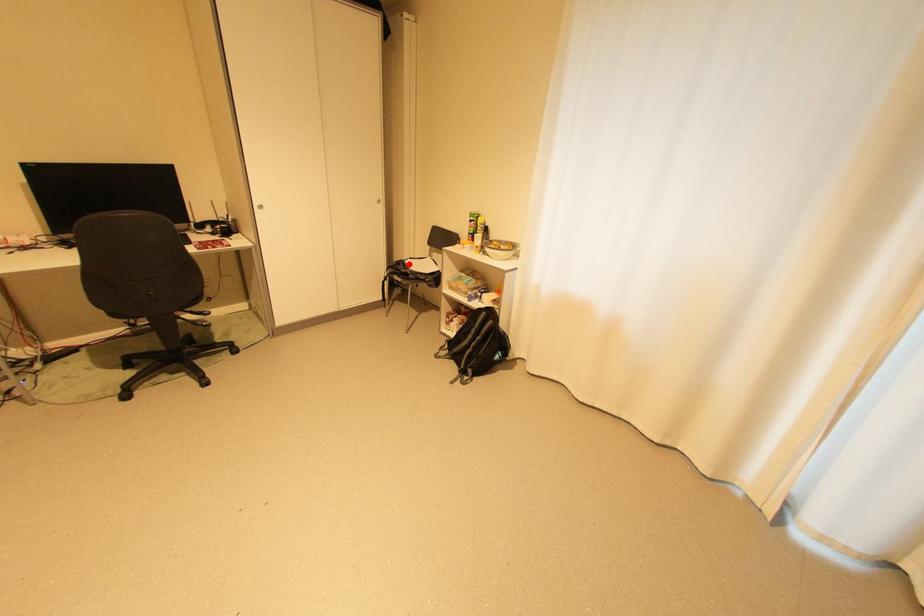
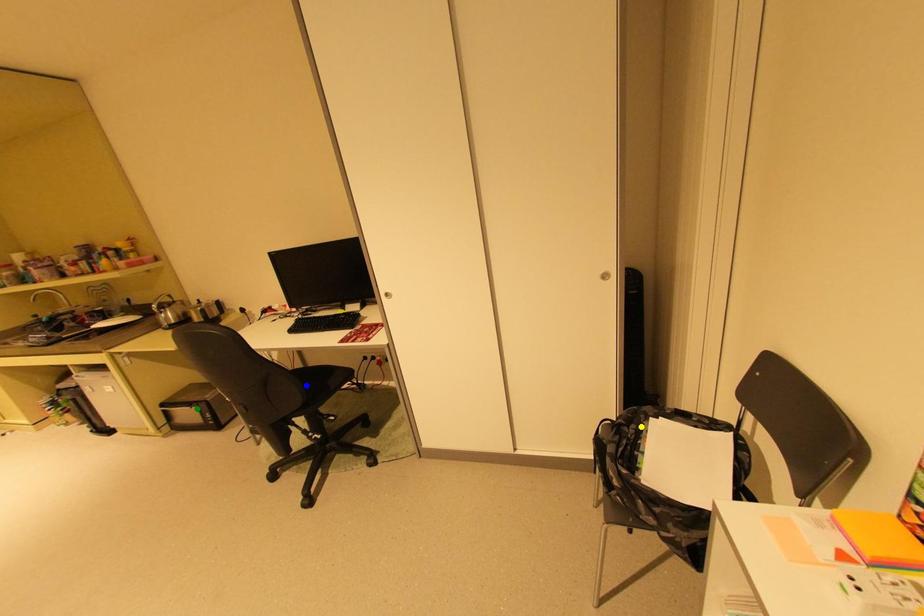
Question: I am providing you with two images of the same scene from different viewpoints. A red point is marked on the first image. You are given multiple points on the second image. Which mark in image 2 goes with the point in image 1?

Choices:
 (A) yellow point
 (B) green point
 (C) blue point

Answer: (A)